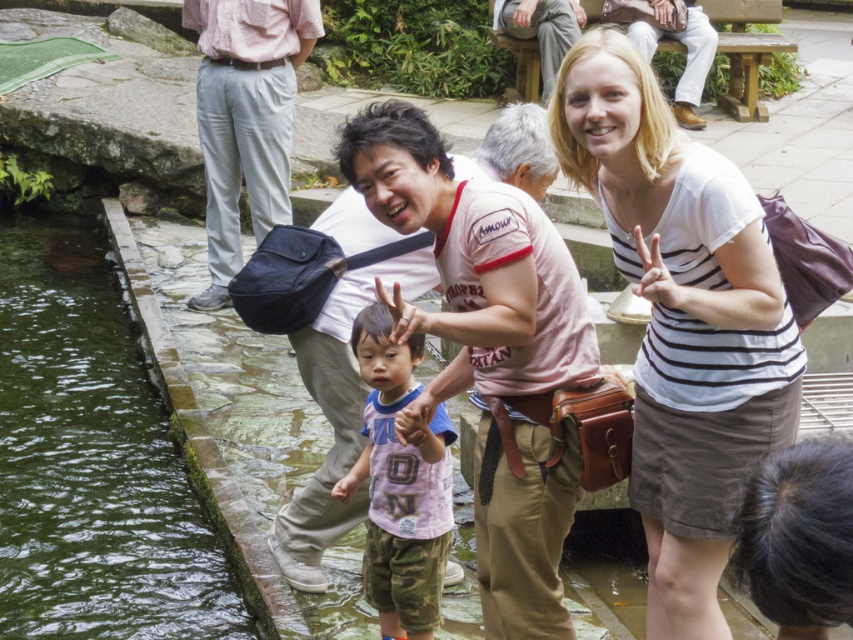
Does white striped shirt at center have a smaller size compared to pink cotton shirt at center?

No.

The height and width of the screenshot is (640, 853). What do you see at coordinates (682, 320) in the screenshot?
I see `white striped shirt at center` at bounding box center [682, 320].

Which is in front, point (704, 529) or point (459, 253)?

Positioned in front is point (704, 529).

Find the location of a particular element. white striped shirt at center is located at coordinates (682, 320).

Can you confirm if pink cotton shirt at center is bigger than matte white shirt at center?

Incorrect, pink cotton shirt at center is not larger than matte white shirt at center.

Is pink cotton shirt at center further to the viewer compared to matte white shirt at center?

No, pink cotton shirt at center is closer to the viewer.

This screenshot has height=640, width=853. What do you see at coordinates (473, 268) in the screenshot?
I see `pink cotton shirt at center` at bounding box center [473, 268].

At what (x,y) coordinates should I click in order to perform the action: click on pink cotton shirt at center. Please return your answer as a coordinate pair (x, y). This screenshot has width=853, height=640. Looking at the image, I should click on (473, 268).

Which is in front, point (154, 460) or point (737, 38)?

Point (154, 460) is more forward.

Is green mossy stone at lower left to the right of matte white shirt at center from the viewer's perspective?

In fact, green mossy stone at lower left is to the left of matte white shirt at center.

Who is more forward, (39, 556) or (585, 259)?

Point (39, 556)

This screenshot has height=640, width=853. What are the coordinates of `green mossy stone at lower left` in the screenshot? It's located at (91, 460).